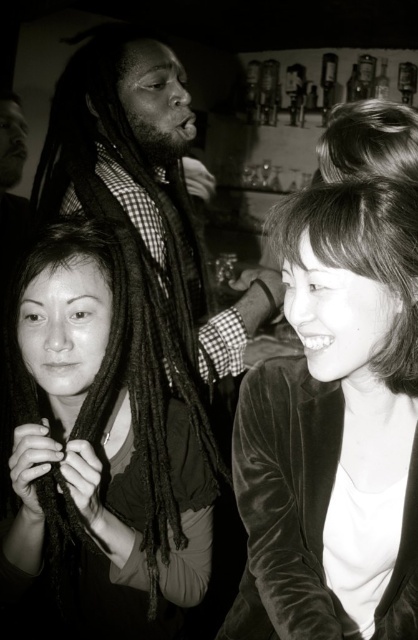
Between velvet-like hair at center and smooth dark hair at lower right, which one is positioned lower?

velvet-like hair at center is lower down.

From the picture: Can you confirm if velvet-like hair at center is positioned to the right of smooth dark hair at lower right?

In fact, velvet-like hair at center is to the left of smooth dark hair at lower right.

Who is more distant from viewer, (x=152, y=417) or (x=405, y=385)?

The point (x=152, y=417) is more distant.

This screenshot has width=418, height=640. In order to click on velvet-like hair at center in this screenshot , I will do pyautogui.click(x=101, y=448).

Is velvet black jacket at lower right positioned before velvet-like hair at center?

Yes, velvet black jacket at lower right is closer to the viewer.

Identify the location of velvet black jacket at lower right. Image resolution: width=418 pixels, height=640 pixels. pyautogui.click(x=334, y=428).

Is point (333, 422) closer to viewer compared to point (63, 321)?

Yes.

Locate an element on the screen. The image size is (418, 640). velvet black jacket at lower right is located at coordinates (334, 428).

Is velvet black jacket at lower right to the left of smooth dark hair at lower right from the viewer's perspective?

Yes, velvet black jacket at lower right is to the left of smooth dark hair at lower right.

In the scene shown: Is velvet black jacket at lower right thinner than smooth dark hair at lower right?

No, velvet black jacket at lower right is not thinner than smooth dark hair at lower right.

Locate an element on the screen. velvet black jacket at lower right is located at coordinates (334, 428).

Identify the location of velvet black jacket at lower right. The width and height of the screenshot is (418, 640). tap(334, 428).